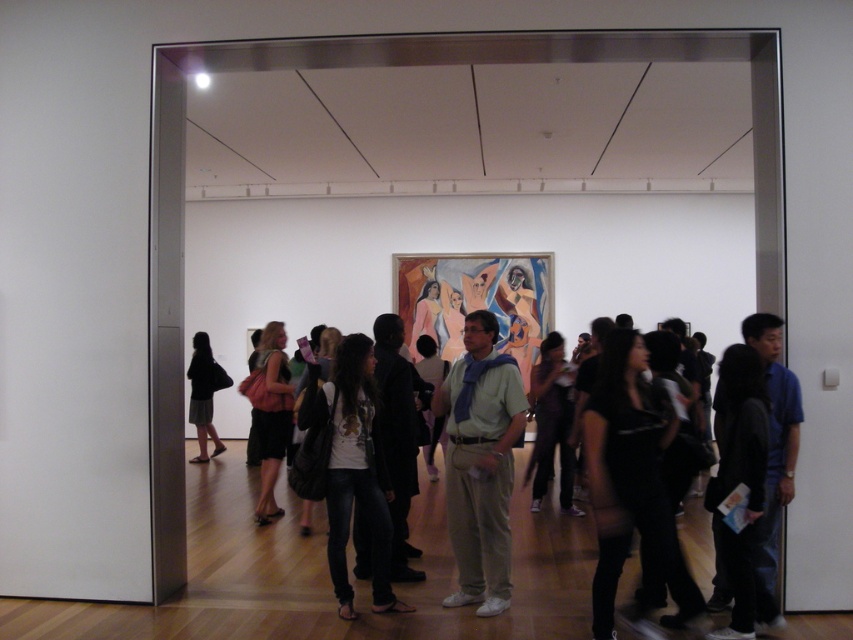
Question: Is light green cotton shirt at center thinner than black fabric bag at left?

Choices:
 (A) yes
 (B) no

Answer: (A)

Question: Can you confirm if jeans at center is positioned above light green cotton shirt at center?

Choices:
 (A) yes
 (B) no

Answer: (B)

Question: Which object is the closest to the light green cotton shirt at center?

Choices:
 (A) black fabric bag at left
 (B) white cotton shirt at center

Answer: (B)

Question: Which point is closer to the camera taking this photo?

Choices:
 (A) (454, 364)
 (B) (508, 618)

Answer: (B)

Question: Does jeans at center have a greater width compared to white cotton shirt at center?

Choices:
 (A) no
 (B) yes

Answer: (A)

Question: Which point is farther to the camera?

Choices:
 (A) (190, 401)
 (B) (440, 483)
 (C) (305, 408)
 (D) (456, 529)

Answer: (A)